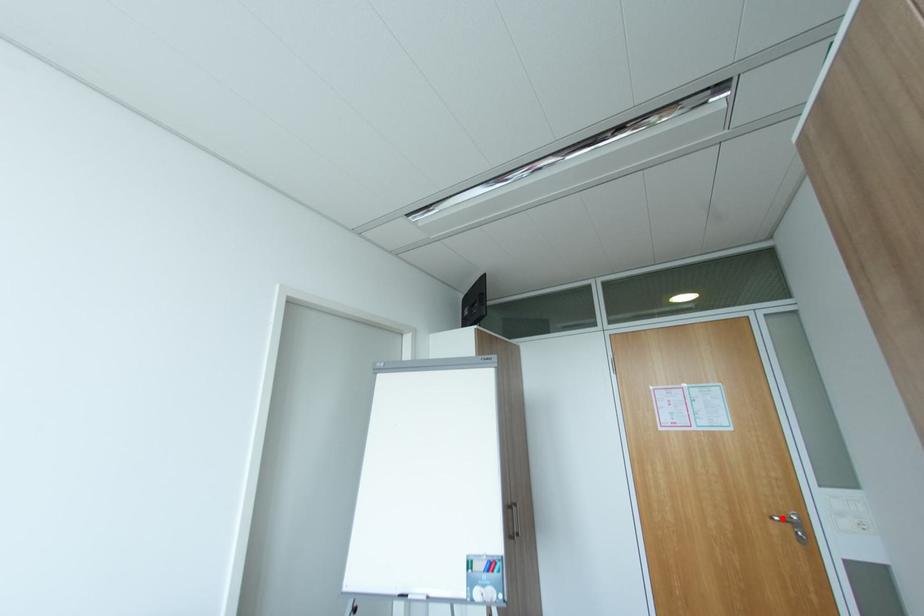
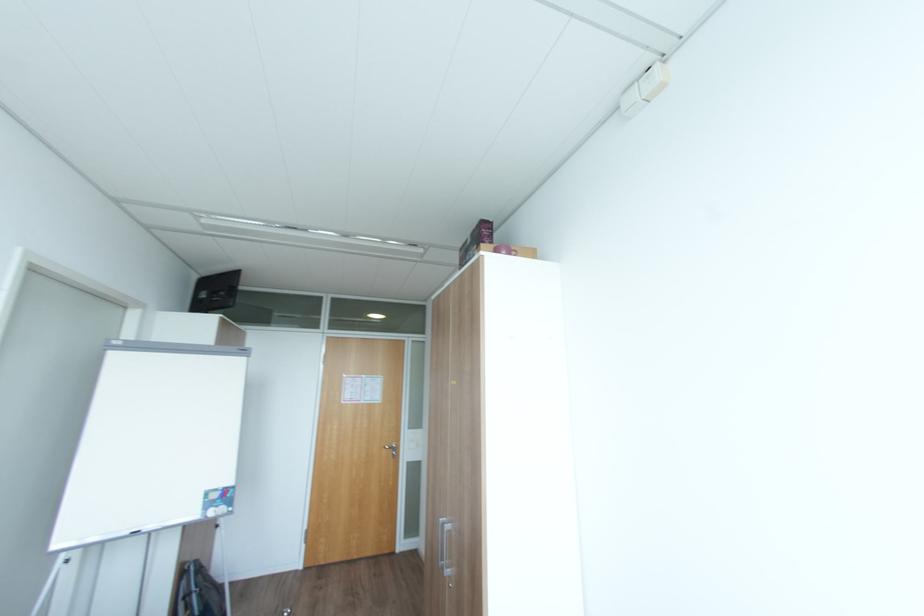
Where in the second image is the point corresponding to the highlighted location from the first image?

(392, 448)